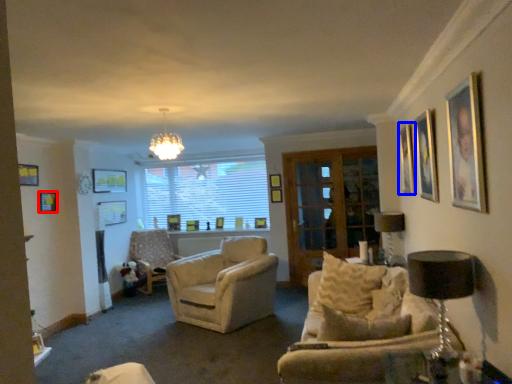
Question: Which object is further to the camera taking this photo, picture frame (highlighted by a red box) or picture frame (highlighted by a blue box)?

Choices:
 (A) picture frame
 (B) picture frame

Answer: (A)